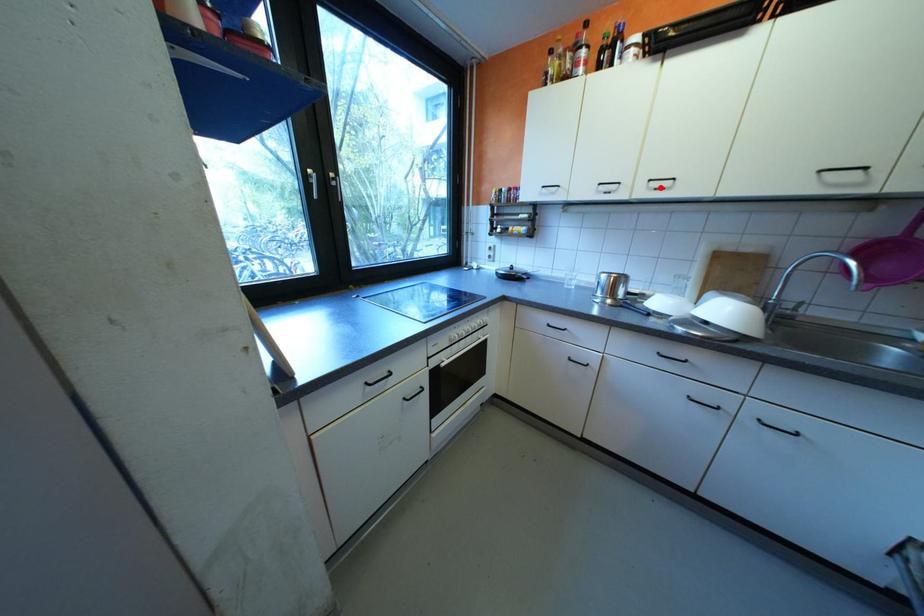
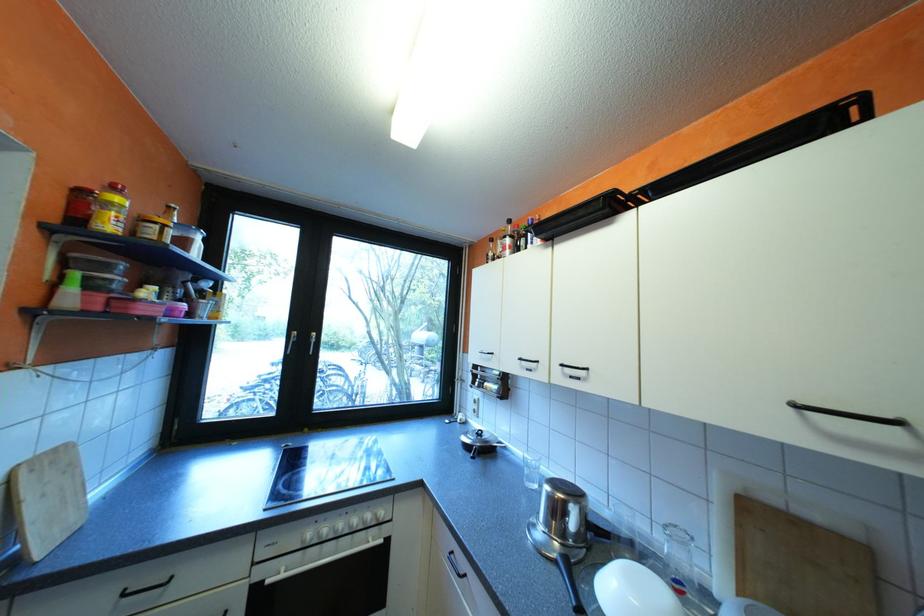
Where in the second image is the point corresponding to the highlighted location from the first image?

(576, 373)